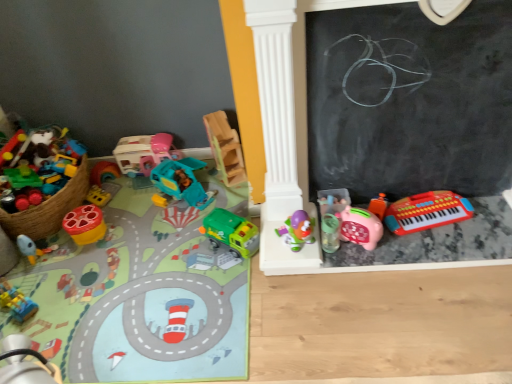
Question: From the image's perspective, is black chalkboard at right on matte plastic toy rocket at lower left, which is the 12th toy from right to left?

Choices:
 (A) no
 (B) yes

Answer: (B)

Question: Considering the relative sizes of black chalkboard at right and matte plastic toy rocket at lower left, which is the 12th toy from right to left, in the image provided, is black chalkboard at right wider than matte plastic toy rocket at lower left, which is the 12th toy from right to left,?

Choices:
 (A) yes
 (B) no

Answer: (B)

Question: Could you tell me if black chalkboard at right is turned towards matte plastic toy rocket at lower left, the first toy from the left?

Choices:
 (A) no
 (B) yes

Answer: (A)

Question: Is black chalkboard at right located outside matte plastic toy rocket at lower left, which is the 12th toy from right to left?

Choices:
 (A) yes
 (B) no

Answer: (A)

Question: Is black chalkboard at right positioned far away from matte plastic toy rocket at lower left, which is the 12th toy from right to left?

Choices:
 (A) yes
 (B) no

Answer: (A)

Question: Is black chalkboard at right next to matte plastic toy rocket at lower left, the first toy from the left?

Choices:
 (A) yes
 (B) no

Answer: (B)

Question: From a real-world perspective, is matte plastic toy car at left, the fourth toy from the left, physically above pink plastic piggy bank at lower right, the second toy positioned from the right?

Choices:
 (A) no
 (B) yes

Answer: (A)

Question: Does matte plastic toy car at left, positioned as the 9th toy in right-to-left order, touch pink plastic piggy bank at lower right, the second toy positioned from the right?

Choices:
 (A) yes
 (B) no

Answer: (B)

Question: Can we say matte plastic toy car at left, the fourth toy from the left, lies outside pink plastic piggy bank at lower right, placed as the 11th toy when sorted from left to right?

Choices:
 (A) yes
 (B) no

Answer: (A)

Question: Are matte plastic toy car at left, the fourth toy from the left, and pink plastic piggy bank at lower right, the second toy positioned from the right, far apart?

Choices:
 (A) yes
 (B) no

Answer: (B)

Question: From a real-world perspective, is matte plastic toy car at left, positioned as the 9th toy in right-to-left order, under pink plastic piggy bank at lower right, placed as the 11th toy when sorted from left to right?

Choices:
 (A) yes
 (B) no

Answer: (A)

Question: Could you tell me if matte plastic toy car at left, the fourth toy from the left, is turned towards pink plastic piggy bank at lower right, the second toy positioned from the right?

Choices:
 (A) no
 (B) yes

Answer: (A)

Question: Does purple plastic toy at center, which is counted as the fourth toy, starting from the right, have a greater height compared to black chalkboard at right?

Choices:
 (A) no
 (B) yes

Answer: (A)